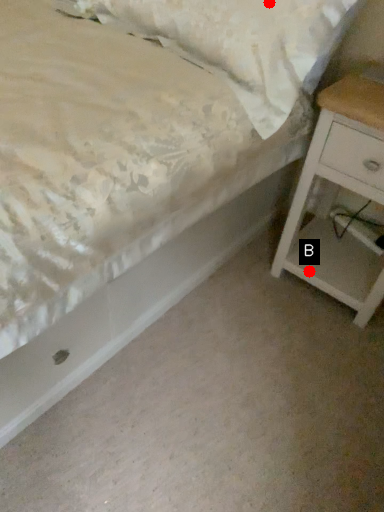
Question: Two points are circled on the image, labeled by A and B beside each circle. Which point is closer to the camera taking this photo?

Choices:
 (A) A is closer
 (B) B is closer

Answer: (A)